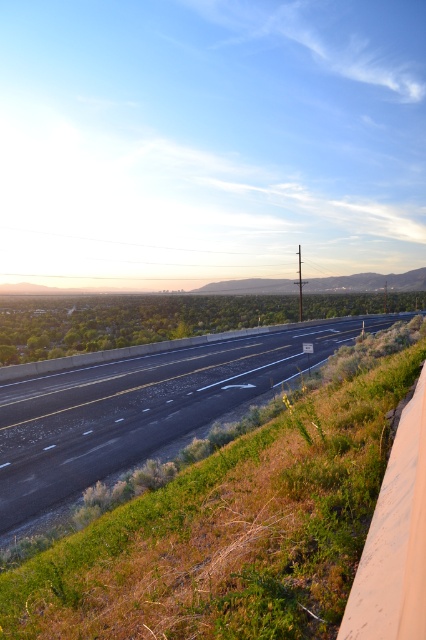
Looking at this image, which is above, asphalt road at center or green grass at lower right?

green grass at lower right

Does asphalt road at center have a lesser width compared to green grass at lower right?

Incorrect, asphalt road at center's width is not less than green grass at lower right's.

Is point (97, 374) farther from viewer compared to point (340, 624)?

Yes, point (97, 374) is farther from viewer.

The image size is (426, 640). Identify the location of asphalt road at center. (140, 412).